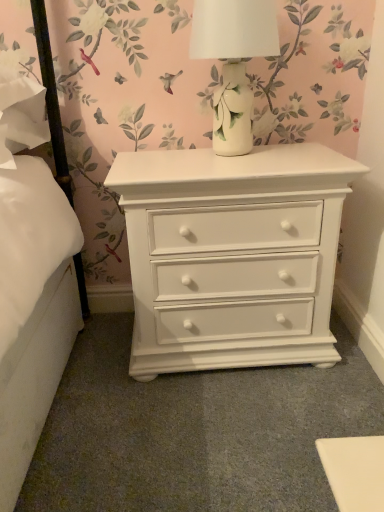
What do you see at coordinates (233, 62) in the screenshot? The width and height of the screenshot is (384, 512). I see `white ceramic vase at upper center` at bounding box center [233, 62].

The width and height of the screenshot is (384, 512). What are the coordinates of `white ceramic vase at upper center` in the screenshot? It's located at (233, 62).

Measure the distance between white ceramic vase at upper center and camera.

white ceramic vase at upper center is 1.02 meters from camera.

I want to click on white painted wood nightstand at center, so click(x=232, y=255).

The height and width of the screenshot is (512, 384). Describe the element at coordinates (232, 255) in the screenshot. I see `white painted wood nightstand at center` at that location.

Find the location of a particular element. white ceramic vase at upper center is located at coordinates (233, 62).

Is white ceramic vase at upper center to the left or to the right of white painted wood nightstand at center in the image?

In the image, white ceramic vase at upper center appears on the left side of white painted wood nightstand at center.

Which object is further away from the camera taking this photo, white ceramic vase at upper center or white painted wood nightstand at center?

white painted wood nightstand at center is behind.

Is point (233, 79) closer or farther from the camera than point (206, 282)?

Point (233, 79) appears to be closer to the viewer than point (206, 282).

From the image's perspective, is white ceramic vase at upper center under white painted wood nightstand at center?

No, from the image's perspective, white ceramic vase at upper center is not beneath white painted wood nightstand at center.

From a real-world perspective, is white ceramic vase at upper center positioned over white painted wood nightstand at center based on gravity?

Yes, from a real-world perspective, white ceramic vase at upper center is above white painted wood nightstand at center.

Can you confirm if white ceramic vase at upper center is thinner than white painted wood nightstand at center?

Correct, the width of white ceramic vase at upper center is less than that of white painted wood nightstand at center.

From the picture: Between white ceramic vase at upper center and white painted wood nightstand at center, which one has less height?

Standing shorter between the two is white ceramic vase at upper center.

Is white ceramic vase at upper center bigger than white painted wood nightstand at center?

No, white ceramic vase at upper center is not bigger than white painted wood nightstand at center.

Does white ceramic vase at upper center contain white painted wood nightstand at center?

Actually, white painted wood nightstand at center is outside white ceramic vase at upper center.

Is there a large distance between white ceramic vase at upper center and white painted wood nightstand at center?

white ceramic vase at upper center is actually quite close to white painted wood nightstand at center.

Does white ceramic vase at upper center turn towards white painted wood nightstand at center?

No, white ceramic vase at upper center does not turn towards white painted wood nightstand at center.

What's the angular difference between white ceramic vase at upper center and white painted wood nightstand at center's facing directions?

They differ by 0.163 degrees in their facing directions.

Measure the distance between white ceramic vase at upper center and white painted wood nightstand at center.

white ceramic vase at upper center and white painted wood nightstand at center are 31.84 centimeters apart from each other.

I want to click on table lamp that is in front of the white painted wood nightstand at center, so click(233, 62).

Looking at this image, can you confirm if white painted wood nightstand at center is positioned to the left of white ceramic vase at upper center?

No.

Is the position of white painted wood nightstand at center more distant than that of white ceramic vase at upper center?

That is True.

Is point (257, 202) closer to camera compared to point (235, 13)?

No, it is not.

From the image's perspective, is white painted wood nightstand at center over white ceramic vase at upper center?

No.

From a real-world perspective, which object stands above the other?

From a 3D spatial view, white ceramic vase at upper center is above.

Considering the sizes of objects white painted wood nightstand at center and white ceramic vase at upper center in the image provided, who is wider, white painted wood nightstand at center or white ceramic vase at upper center?

With larger width is white painted wood nightstand at center.

Looking at this image, is white painted wood nightstand at center taller or shorter than white ceramic vase at upper center?

In the image, white painted wood nightstand at center appears to be taller than white ceramic vase at upper center.

In terms of size, does white painted wood nightstand at center appear bigger or smaller than white ceramic vase at upper center?

white painted wood nightstand at center is bigger than white ceramic vase at upper center.

Would you say white painted wood nightstand at center is inside or outside white ceramic vase at upper center?

white painted wood nightstand at center lies outside white ceramic vase at upper center.

Is the surface of white painted wood nightstand at center in direct contact with white ceramic vase at upper center?

No.

Is white painted wood nightstand at center aimed at white ceramic vase at upper center?

No, white painted wood nightstand at center is not facing towards white ceramic vase at upper center.

What's the angular difference between white painted wood nightstand at center and white ceramic vase at upper center's facing directions?

0.163 degrees.

Where is `table lamp lying in front of the white painted wood nightstand at center`? The height and width of the screenshot is (512, 384). table lamp lying in front of the white painted wood nightstand at center is located at coordinates (x=233, y=62).

Where is `nightstand below the white ceramic vase at upper center (from a real-world perspective)`? nightstand below the white ceramic vase at upper center (from a real-world perspective) is located at coordinates (232, 255).

Find the location of a particular element. The width and height of the screenshot is (384, 512). table lamp that appears in front of the white painted wood nightstand at center is located at coordinates (x=233, y=62).